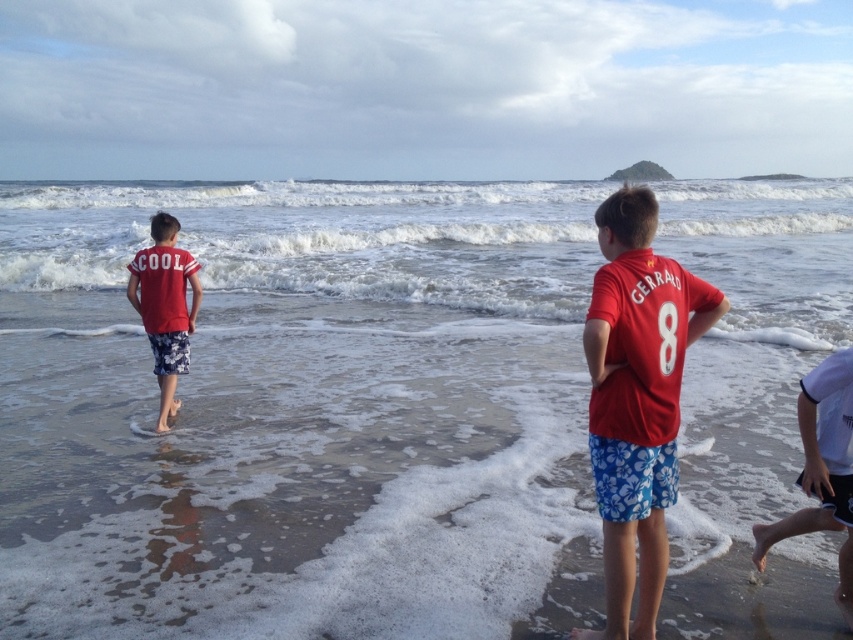
Question: Among these objects, which one is farthest from the camera?

Choices:
 (A) white foamy water at center
 (B) smooth sand beach at center
 (C) matte red t-shirt at center
 (D) matte red t-shirt at left

Answer: (A)

Question: Is smooth sand beach at center smaller than matte red t-shirt at left?

Choices:
 (A) no
 (B) yes

Answer: (A)

Question: Which object is farther from the camera taking this photo?

Choices:
 (A) white foamy water at center
 (B) matte red t-shirt at left
 (C) matte red t-shirt at center
 (D) smooth sand beach at center

Answer: (A)

Question: Does white foamy water at center appear on the left side of matte red t-shirt at center?

Choices:
 (A) yes
 (B) no

Answer: (A)

Question: Considering the relative positions of smooth sand beach at center and white foamy water at center in the image provided, where is smooth sand beach at center located with respect to white foamy water at center?

Choices:
 (A) left
 (B) right

Answer: (B)

Question: Which point is closer to the camera?

Choices:
 (A) smooth sand beach at center
 (B) matte red t-shirt at left
 (C) white foamy water at center
 (D) matte red t-shirt at center

Answer: (D)